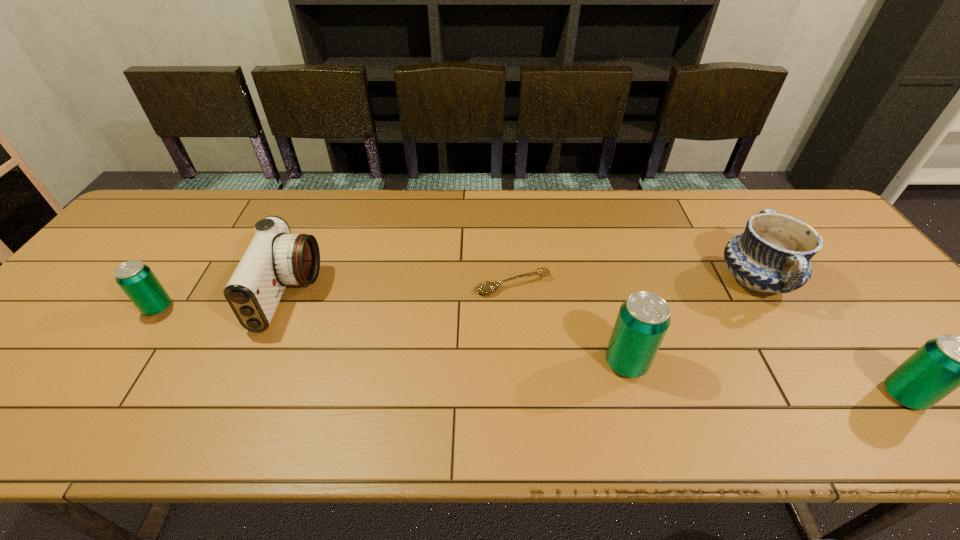
Where is `vacant space in between the second beer can from left to right and the fifth object from right to left`? vacant space in between the second beer can from left to right and the fifth object from right to left is located at coordinates (458, 328).

Identify the location of vacant region between the leftmost object and the camcorder. (224, 301).

The image size is (960, 540). What are the coordinates of `free space between the shortest object and the farthest beer can` in the screenshot? It's located at (336, 296).

Locate which object ranks fifth in proximity to the rightmost beer can. Please provide its 2D coordinates. Your answer should be formatted as a tuple, i.e. [(x, y)], where the tuple contains the x and y coordinates of a point satisfying the conditions above.

[(137, 280)]

Identify the location of the second closest object to the rightmost object. This screenshot has width=960, height=540. (643, 319).

Identify which beer can is the second closest to the second shortest beer can. Please provide its 2D coordinates. Your answer should be formatted as a tuple, i.e. [(x, y)], where the tuple contains the x and y coordinates of a point satisfying the conditions above.

[(137, 280)]

Choose which beer can is the second nearest neighbor to the ladle. Please provide its 2D coordinates. Your answer should be formatted as a tuple, i.e. [(x, y)], where the tuple contains the x and y coordinates of a point satisfying the conditions above.

[(941, 365)]

You are a GUI agent. You are given a task and a screenshot of the screen. Output one action in this format:
    pyautogui.click(x=<x>, y=<y>)
    Task: Click on the free space that satisfies the following two spatial constraints: 1. on the surface of the camcorder; 2. on the front side of the shortest beer can
    
    Given the screenshot: What is the action you would take?
    pyautogui.click(x=283, y=308)

The image size is (960, 540). Find the location of `free location that satisfies the following two spatial constraints: 1. on the front side of the rightmost object; 2. on the left side of the shortest object`. free location that satisfies the following two spatial constraints: 1. on the front side of the rightmost object; 2. on the left side of the shortest object is located at coordinates (521, 395).

Find the location of a particular element. free space that satisfies the following two spatial constraints: 1. on the surface of the rightmost object; 2. on the left side of the fifth object from right to left is located at coordinates (247, 395).